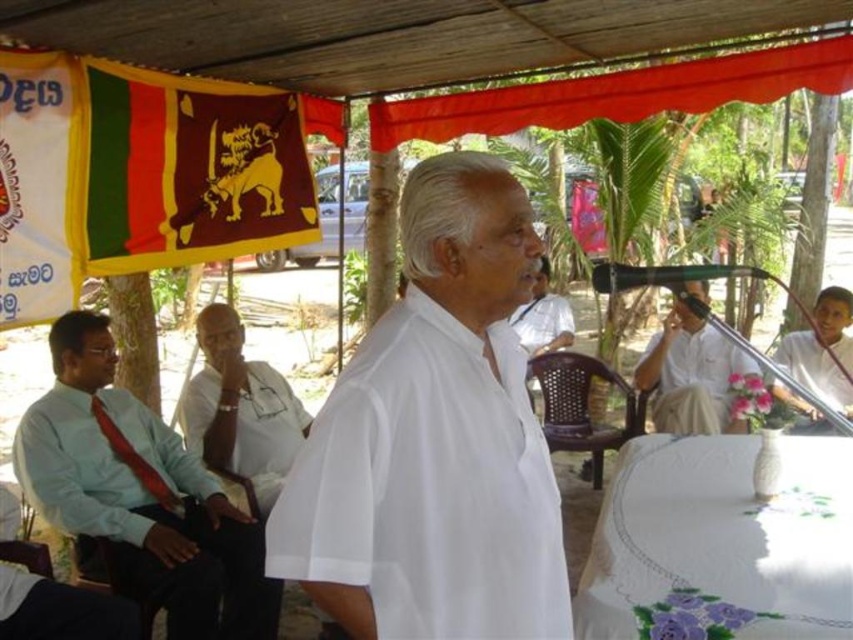
Is light blue shirt at left below green matte microphone at center?

Yes.

Which is below, light blue shirt at left or green matte microphone at center?

light blue shirt at left

Between point (71, 429) and point (750, 269), which one is positioned in front?

Point (750, 269)

Locate an element on the screen. The width and height of the screenshot is (853, 640). light blue shirt at left is located at coordinates (140, 496).

Is point (376, 108) more distant than point (676, 346)?

No, it is in front of (676, 346).

Which is above, matte fabric flag at upper center or white cotton shirt at center?

matte fabric flag at upper center is higher up.

Is point (465, 116) less distant than point (733, 371)?

Yes, it is in front of point (733, 371).

The image size is (853, 640). Find the location of `matte fabric flag at upper center`. matte fabric flag at upper center is located at coordinates (618, 93).

Can you confirm if white embroidered tablecloth at lower right is positioned above yellow fabric flag at upper left?

No, white embroidered tablecloth at lower right is not above yellow fabric flag at upper left.

Can you confirm if white embroidered tablecloth at lower right is wider than yellow fabric flag at upper left?

Yes.

Does point (712, 442) come closer to viewer compared to point (59, 214)?

No, (712, 442) is further to viewer.

Identify the location of white embroidered tablecloth at lower right. (720, 544).